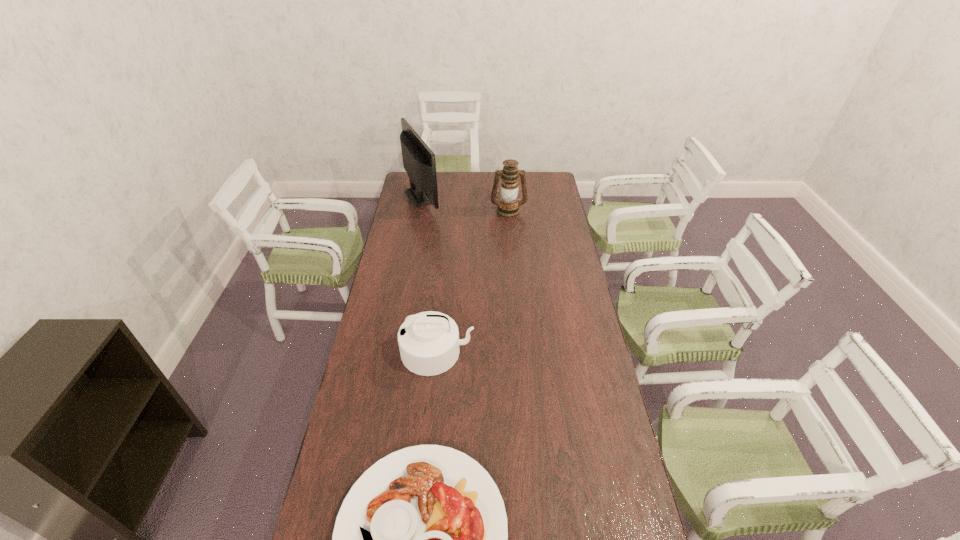
Identify the location of object at the far left corner. This screenshot has height=540, width=960. click(x=419, y=162).

Find the location of `free space at the far edge of the desktop`. free space at the far edge of the desktop is located at coordinates (437, 176).

Where is `free region at the left edge of the desktop`? The width and height of the screenshot is (960, 540). free region at the left edge of the desktop is located at coordinates (383, 266).

You are a GUI agent. You are given a task and a screenshot of the screen. Output one action in this format:
    pyautogui.click(x=<x>, y=<y>)
    Task: Click on the vacant space at the right edge of the desktop
    This screenshot has height=540, width=960.
    Given the screenshot: What is the action you would take?
    pyautogui.click(x=531, y=202)

Image resolution: width=960 pixels, height=540 pixels. Find the location of `vacant area at the far left corner`. vacant area at the far left corner is located at coordinates (407, 174).

This screenshot has height=540, width=960. In the image, there is a desktop. In order to click on vacant region at the far right corner in this screenshot , I will do `click(531, 188)`.

This screenshot has height=540, width=960. In order to click on free space between the lantern and the computer monitor in this screenshot , I will do `click(466, 203)`.

Identify the location of free space between the second tallest object and the third farthest object. This screenshot has height=540, width=960. (473, 281).

Where is `vacant space that is in between the tallest object and the kettle`? This screenshot has width=960, height=540. vacant space that is in between the tallest object and the kettle is located at coordinates (430, 274).

Locate an element on the screen. This screenshot has width=960, height=540. free space between the kettle and the tallest object is located at coordinates (430, 274).